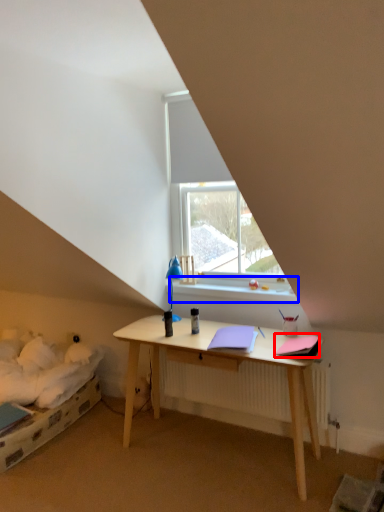
Question: Which point is further to the camera, notebook (highlighted by a red box) or window sill (highlighted by a blue box)?

Choices:
 (A) notebook
 (B) window sill

Answer: (B)